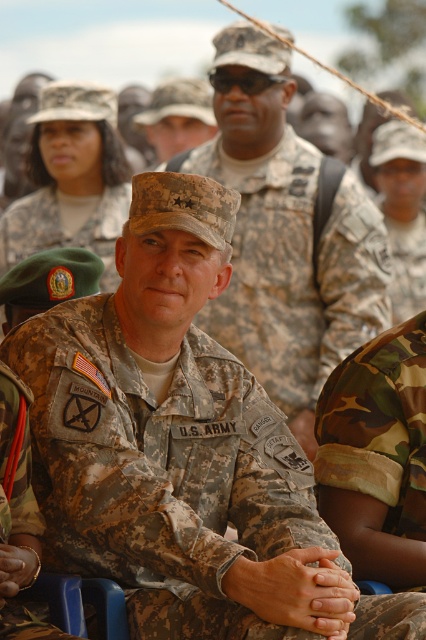
You are a military recruit observing the scene. You notice the camouflage fabric us army uniform at center and the green beret at center. Which object is located to the right of the other?

The camouflage fabric us army uniform at center is positioned on the right side of green beret at center.

You are a military tailor assessing the uniforms in the image. You need to determine which uniform is wider between the camouflage uniform at center and the camouflage fabric uniform at center. Which one is wider?

The camouflage uniform at center is wider than the camouflage fabric uniform at center according to the description.